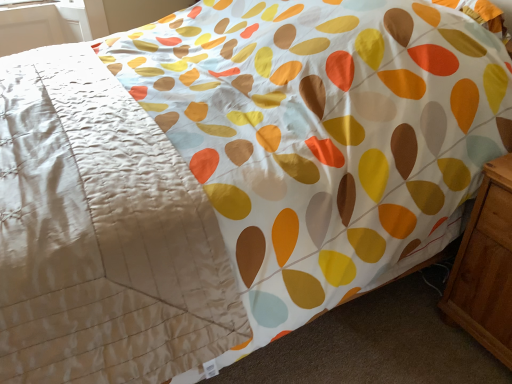
At what (x,y) coordinates should I click in order to perform the action: click on light brown wood at right. Please return your answer as a coordinate pair (x, y). The image size is (512, 384). Looking at the image, I should click on (486, 266).

Describe the element at coordinates (486, 266) in the screenshot. The width and height of the screenshot is (512, 384). I see `light brown wood at right` at that location.

Describe the element at coordinates (101, 234) in the screenshot. I see `silky beige blanket at upper left` at that location.

You are a GUI agent. You are given a task and a screenshot of the screen. Output one action in this format:
    pyautogui.click(x=<x>, y=<y>)
    Task: Click on the silky beige blanket at upper left
    The width and height of the screenshot is (512, 384).
    Given the screenshot: What is the action you would take?
    pyautogui.click(x=101, y=234)

This screenshot has height=384, width=512. I want to click on light brown wood at right, so click(486, 266).

Can you confirm if light brown wood at right is positioned to the right of silky beige blanket at upper left?

Yes.

Looking at this image, which is behind, light brown wood at right or silky beige blanket at upper left?

light brown wood at right is further away from the camera.

Is point (441, 300) closer to camera compared to point (106, 327)?

No.

From the image's perspective, is light brown wood at right beneath silky beige blanket at upper left?

Correct, light brown wood at right appears lower than silky beige blanket at upper left in the image.

From a real-world perspective, is light brown wood at right positioned under silky beige blanket at upper left based on gravity?

Correct, in the physical world, light brown wood at right is lower than silky beige blanket at upper left.

Does light brown wood at right have a lesser width compared to silky beige blanket at upper left?

Yes, light brown wood at right is thinner than silky beige blanket at upper left.

Can you confirm if light brown wood at right is taller than silky beige blanket at upper left?

Indeed, light brown wood at right has a greater height compared to silky beige blanket at upper left.

Which of these two, light brown wood at right or silky beige blanket at upper left, is smaller?

light brown wood at right is smaller.

Do you think light brown wood at right is within silky beige blanket at upper left, or outside of it?

light brown wood at right is located beyond the bounds of silky beige blanket at upper left.

Does light brown wood at right touch silky beige blanket at upper left?

No, light brown wood at right is not touching silky beige blanket at upper left.

Is light brown wood at right looking in the opposite direction of silky beige blanket at upper left?

No, light brown wood at right's orientation is not away from silky beige blanket at upper left.

How different are the orientations of light brown wood at right and silky beige blanket at upper left in degrees?

0.000724 degrees separate the facing orientations of light brown wood at right and silky beige blanket at upper left.

Identify the location of blanket above the light brown wood at right (from a real-world perspective). (101, 234).

Does silky beige blanket at upper left appear on the left side of light brown wood at right?

Indeed, silky beige blanket at upper left is positioned on the left side of light brown wood at right.

Considering their positions, is silky beige blanket at upper left located in front of or behind light brown wood at right?

Visually, silky beige blanket at upper left is located in front of light brown wood at right.

Is point (136, 356) in front of point (472, 243)?

Yes, it is.

From the image's perspective, which object appears higher, silky beige blanket at upper left or light brown wood at right?

silky beige blanket at upper left, from the image's perspective.

From a real-world perspective, which is physically below, silky beige blanket at upper left or light brown wood at right?

light brown wood at right is physically lower.

Considering the sizes of objects silky beige blanket at upper left and light brown wood at right in the image provided, who is wider, silky beige blanket at upper left or light brown wood at right?

With larger width is silky beige blanket at upper left.

Considering the sizes of objects silky beige blanket at upper left and light brown wood at right in the image provided, who is shorter, silky beige blanket at upper left or light brown wood at right?

silky beige blanket at upper left is shorter.

Considering the sizes of objects silky beige blanket at upper left and light brown wood at right in the image provided, who is bigger, silky beige blanket at upper left or light brown wood at right?

Bigger between the two is silky beige blanket at upper left.

Is silky beige blanket at upper left completely or partially outside of light brown wood at right?

Indeed, silky beige blanket at upper left is completely outside light brown wood at right.

Are silky beige blanket at upper left and light brown wood at right beside each other?

No, silky beige blanket at upper left is not next to light brown wood at right.

Is light brown wood at right at the back of silky beige blanket at upper left?

Yes, light brown wood at right is at the back of silky beige blanket at upper left.

You are a GUI agent. You are given a task and a screenshot of the screen. Output one action in this format:
    pyautogui.click(x=<x>, y=<y>)
    Task: Click on the blanket in front of the light brown wood at right
    The image size is (512, 384).
    Given the screenshot: What is the action you would take?
    pyautogui.click(x=101, y=234)

Locate an element on the screen. blanket lying in front of the light brown wood at right is located at coordinates (101, 234).

Locate an element on the screen. Image resolution: width=512 pixels, height=384 pixels. blanket above the light brown wood at right (from a real-world perspective) is located at coordinates (101, 234).